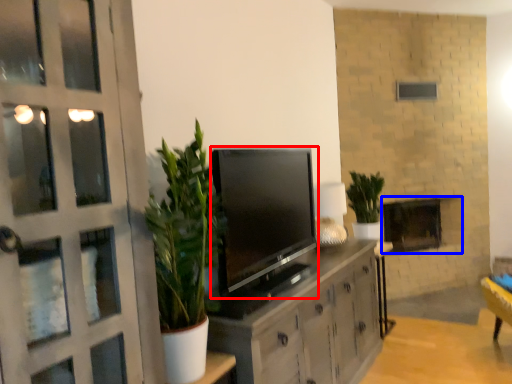
Question: Which object is closer to the camera taking this photo, television (highlighted by a red box) or fireplace (highlighted by a blue box)?

Choices:
 (A) television
 (B) fireplace

Answer: (A)